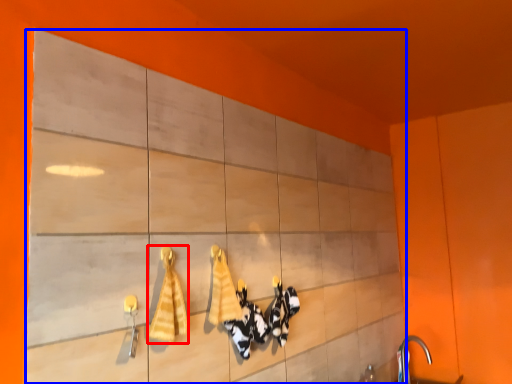
Question: Among these objects, which one is farthest to the camera, bath towel (highlighted by a red box) or cabinetry (highlighted by a blue box)?

Choices:
 (A) bath towel
 (B) cabinetry

Answer: (A)